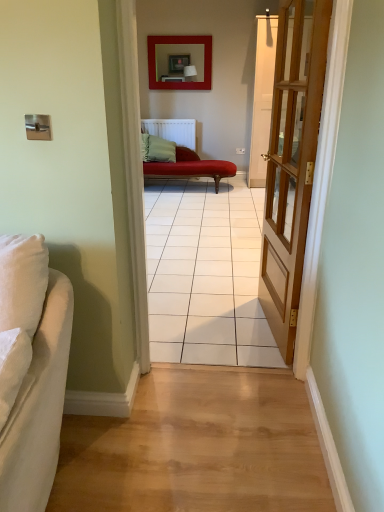
Question: Is light brown wooden door at right beside velvet red chaise at center, which is the 1th studio couch from top to bottom?

Choices:
 (A) yes
 (B) no

Answer: (B)

Question: From a real-world perspective, does light brown wooden door at right stand above velvet red chaise at center, the 1th studio couch positioned from the back?

Choices:
 (A) no
 (B) yes

Answer: (B)

Question: Is the depth of light brown wooden door at right greater than that of velvet red chaise at center, which is the second studio couch in left-to-right order?

Choices:
 (A) yes
 (B) no

Answer: (B)

Question: From a real-world perspective, is light brown wooden door at right physically below velvet red chaise at center, the 2th studio couch in the front-to-back sequence?

Choices:
 (A) no
 (B) yes

Answer: (A)

Question: Is light brown wooden door at right at the left side of velvet red chaise at center, the 2th studio couch in the front-to-back sequence?

Choices:
 (A) yes
 (B) no

Answer: (B)

Question: Is the depth of light brown wooden door at right less than that of velvet red chaise at center, which is the second studio couch in left-to-right order?

Choices:
 (A) yes
 (B) no

Answer: (A)

Question: From a real-world perspective, is light brown wooden door at right over matte red picture frame at upper center?

Choices:
 (A) no
 (B) yes

Answer: (A)

Question: Would you consider light brown wooden door at right to be distant from matte red picture frame at upper center?

Choices:
 (A) no
 (B) yes

Answer: (B)

Question: Can you confirm if light brown wooden door at right is smaller than matte red picture frame at upper center?

Choices:
 (A) yes
 (B) no

Answer: (B)

Question: Is light brown wooden door at right aimed at matte red picture frame at upper center?

Choices:
 (A) yes
 (B) no

Answer: (B)

Question: Does light brown wooden door at right lie behind matte red picture frame at upper center?

Choices:
 (A) yes
 (B) no

Answer: (B)

Question: Is light brown wooden door at right turned away from matte red picture frame at upper center?

Choices:
 (A) yes
 (B) no

Answer: (B)

Question: From the image's perspective, is white fabric couch at left, the first studio couch in the front-to-back sequence, above velvet red chaise at center, the first studio couch when ordered from right to left?

Choices:
 (A) yes
 (B) no

Answer: (B)